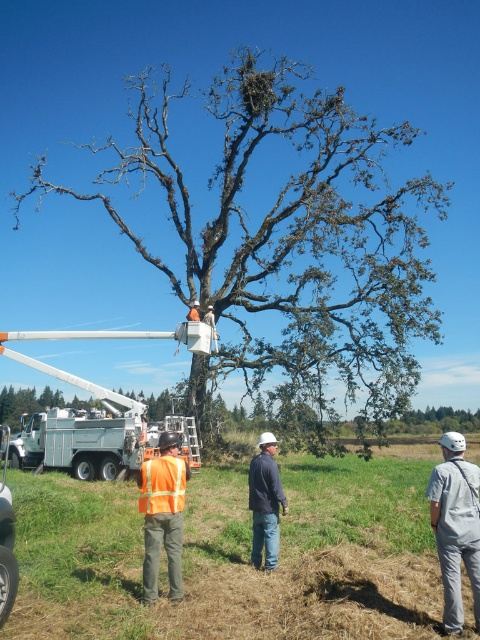
Question: Can you confirm if gray fabric backpack at lower right is thinner than dark blue jeans at center?

Choices:
 (A) yes
 (B) no

Answer: (B)

Question: Does gray fabric backpack at lower right come in front of reflective orange vest at center?

Choices:
 (A) yes
 (B) no

Answer: (A)

Question: Is white metallic trailer truck at lower left below dark blue jeans at center?

Choices:
 (A) yes
 (B) no

Answer: (A)

Question: Considering the real-world distances, which object is closest to the reflective orange vest at center?

Choices:
 (A) dark blue jeans at center
 (B) green leafy tree at center
 (C) gray fabric backpack at lower right

Answer: (A)

Question: Among these points, which one is nearest to the camera?

Choices:
 (A) (145, 516)
 (B) (262, 476)
 (C) (447, 600)
 (D) (35, 413)

Answer: (C)

Question: Among these objects, which one is farthest from the camera?

Choices:
 (A) gray fabric backpack at lower right
 (B) green leafy tree at center

Answer: (B)